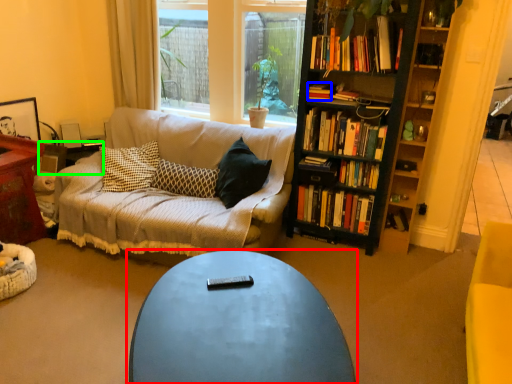
Question: Which object is positioned farthest from coffee table (highlighted by a red box)? Select from book (highlighted by a blue box) and side table (highlighted by a green box).

Choices:
 (A) book
 (B) side table

Answer: (B)